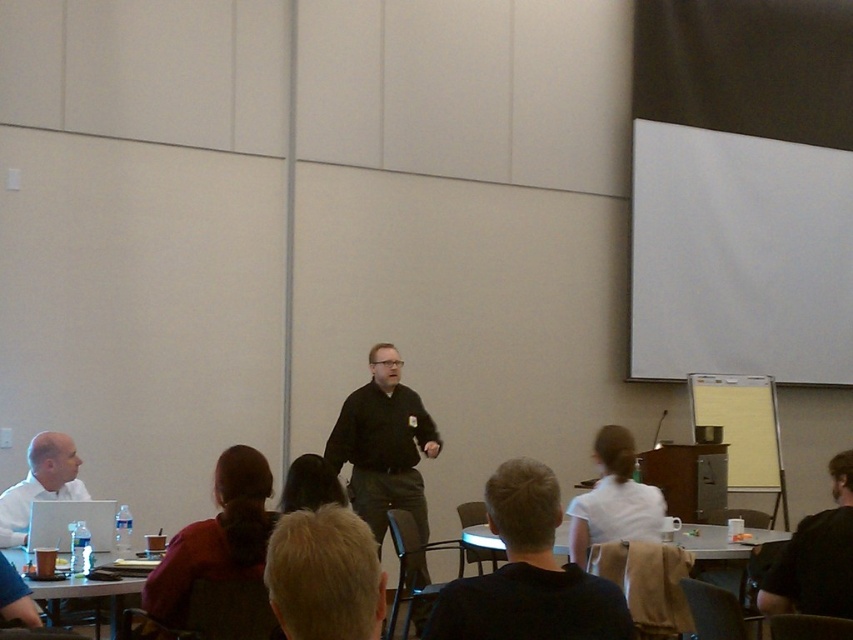
Which is in front, point (370, 483) or point (813, 566)?

Point (813, 566) is in front.

Which of these two, black matte shirt at center or black fabric shirt at lower right, stands shorter?

With less height is black fabric shirt at lower right.

Describe the element at coordinates (383, 444) in the screenshot. I see `black matte shirt at center` at that location.

At what (x,y) coordinates should I click in order to perform the action: click on black matte shirt at center. Please return your answer as a coordinate pair (x, y). Image resolution: width=853 pixels, height=640 pixels. Looking at the image, I should click on pos(383,444).

Between dark red shirt at lower left and matte black laptop at left, which one is positioned lower?

Positioned lower is matte black laptop at left.

Does dark red shirt at lower left have a lesser height compared to matte black laptop at left?

No, dark red shirt at lower left is not shorter than matte black laptop at left.

You are a GUI agent. You are given a task and a screenshot of the screen. Output one action in this format:
    pyautogui.click(x=<x>, y=<y>)
    Task: Click on the dark red shirt at lower left
    
    Given the screenshot: What is the action you would take?
    pyautogui.click(x=216, y=538)

Locate an element on the screen. dark red shirt at lower left is located at coordinates (216, 538).

Which is in front, point (776, 310) or point (816, 513)?

Positioned in front is point (776, 310).

Does white matte projection screen at upper right have a larger size compared to black fabric shirt at lower right?

Indeed, white matte projection screen at upper right has a larger size compared to black fabric shirt at lower right.

Find the location of a particular element. The width and height of the screenshot is (853, 640). white matte projection screen at upper right is located at coordinates (740, 257).

Where is `white matte projection screen at upper right`? The width and height of the screenshot is (853, 640). white matte projection screen at upper right is located at coordinates (740, 257).